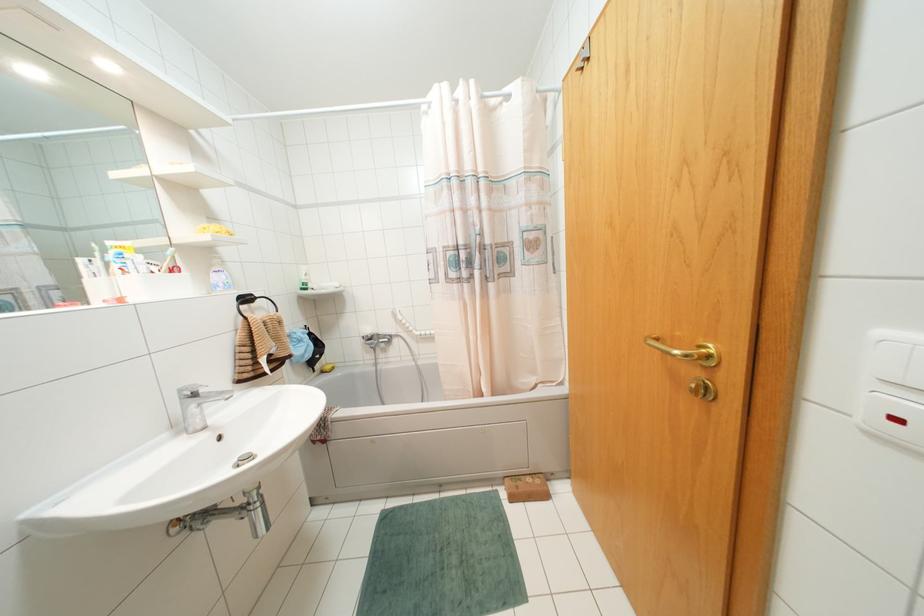
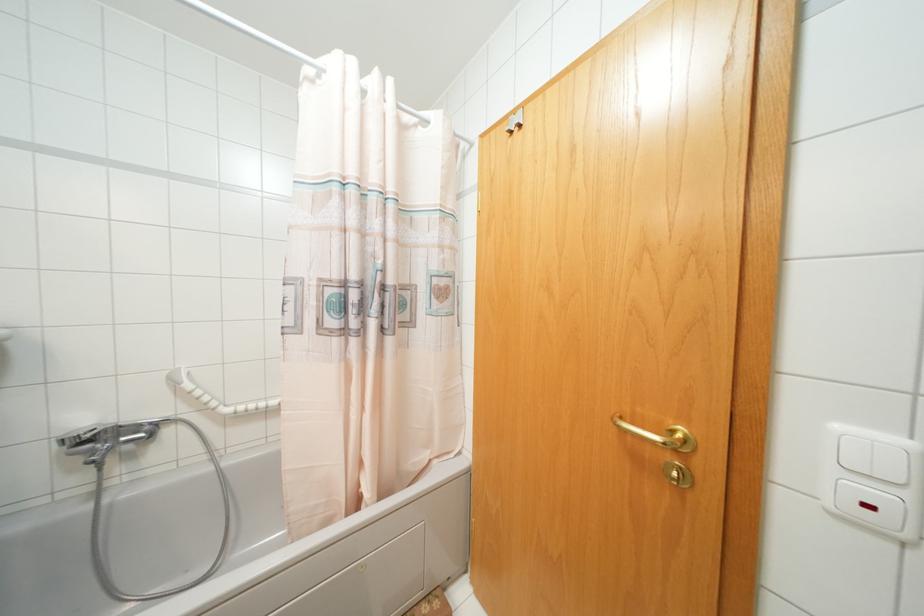
Locate, in the second image, the point that corresponds to (x=709, y=355) in the first image.

(686, 440)